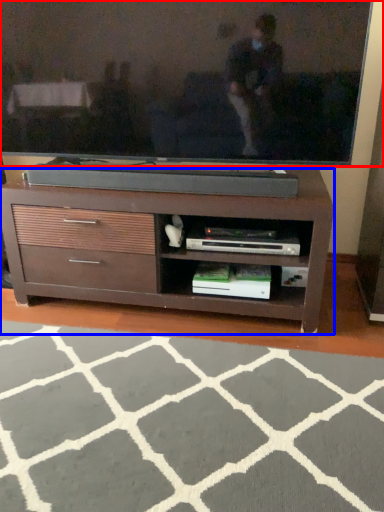
Question: Among these objects, which one is farthest to the camera, television (highlighted by a red box) or chest of drawers (highlighted by a blue box)?

Choices:
 (A) television
 (B) chest of drawers

Answer: (B)